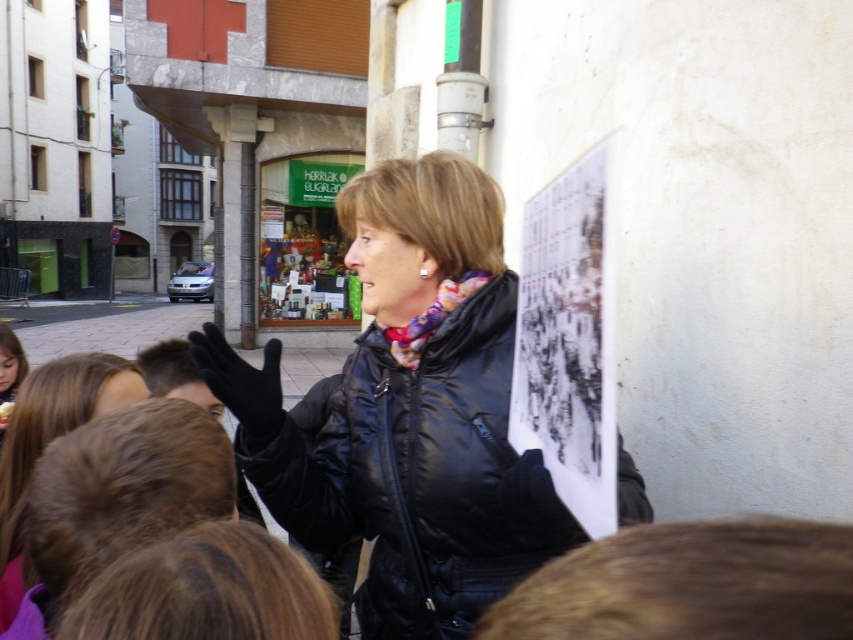
You are a photographer trying to capture both the black matte jacket at center and the black paper at upper right in a single shot. Based on their sizes in the scene, which object would appear larger in your photo?

The black matte jacket at center would appear larger in the photo since it is much taller than the black paper at upper right.

You are a photographer standing in the scene. You want to take a photo of the black matte jacket at center and the black paper at upper right together in the frame. Considering their distance, will you need to zoom out your camera lens to include both objects in the shot?

The distance between the black matte jacket at center and the black paper at upper right is 9.15 inches. To capture both in the same frame, you would need to zoom out your camera lens to accommodate the space between them.

You are a photographer trying to capture a clear shot of the black matte jacket at center and the black paper at upper right. Since you want both objects in focus, which one should you focus on first to ensure depth of field?

You should focus on the black matte jacket at center first because it is closer to you than the black paper at upper right. This way, the depth of field will likely include both objects in focus.